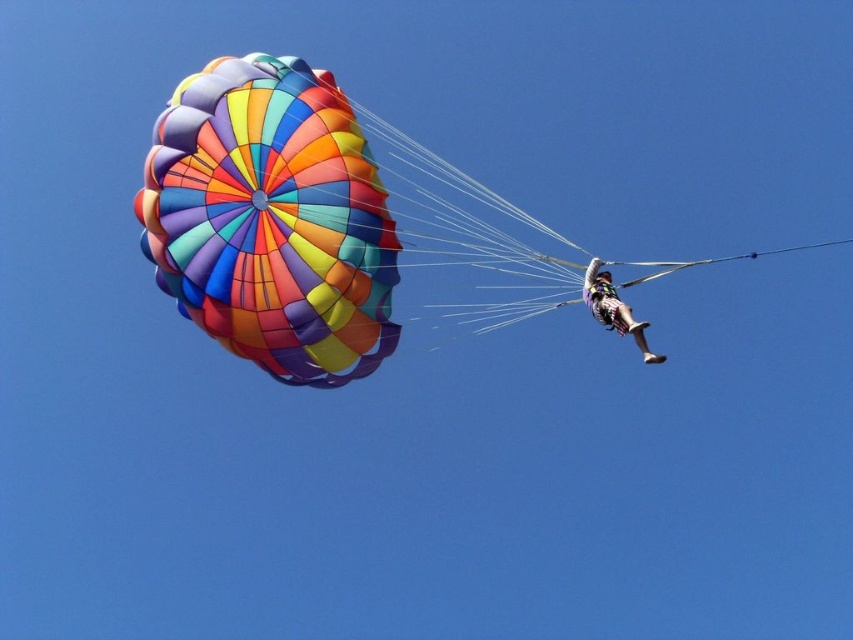
Question: Among these points, which one is farthest from the camera?

Choices:
 (A) (497, 272)
 (B) (289, 260)

Answer: (A)

Question: Does multicolored fabric parachute at upper left have a larger size compared to multicolored fabric parachute at upper center?

Choices:
 (A) yes
 (B) no

Answer: (A)

Question: Which point appears farthest from the camera in this image?

Choices:
 (A) (611, 282)
 (B) (397, 337)
 (C) (376, 232)

Answer: (B)

Question: Is multicolored fabric parachute at upper center positioned in front of multicolored fabric parachute at upper right?

Choices:
 (A) yes
 (B) no

Answer: (B)

Question: Can you confirm if multicolored fabric parachute at upper left is positioned below multicolored fabric parachute at upper right?

Choices:
 (A) no
 (B) yes

Answer: (A)

Question: Which of these objects is positioned closest to the multicolored fabric parachute at upper left?

Choices:
 (A) multicolored fabric parachute at upper center
 (B) multicolored fabric parachute at upper right

Answer: (A)